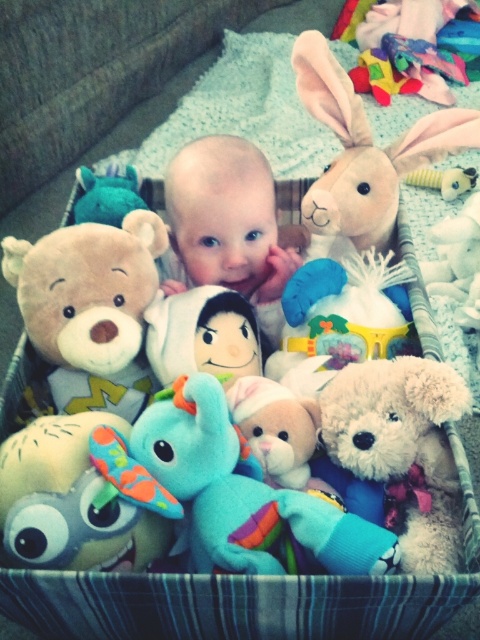
Does soft plush toys at center have a smaller size compared to teal plush elephant at center?

No, soft plush toys at center is not smaller than teal plush elephant at center.

Does point (144, 180) come farther from viewer compared to point (250, 472)?

Yes, point (144, 180) is farther from viewer.

Locate an element on the screen. soft plush toys at center is located at coordinates (229, 605).

Between teal plush elephant at center and soft plush elephant at center, which one appears on the right side from the viewer's perspective?

teal plush elephant at center is more to the right.

Can you confirm if teal plush elephant at center is positioned to the left of soft plush elephant at center?

No, teal plush elephant at center is not to the left of soft plush elephant at center.

Between point (204, 502) and point (141, 536), which one is positioned in front?

Positioned in front is point (141, 536).

Where is `teal plush elephant at center`? The image size is (480, 640). teal plush elephant at center is located at coordinates (243, 492).

Does smooth skin baby at center appear over multicolored fabric toy at upper right?

Actually, smooth skin baby at center is below multicolored fabric toy at upper right.

Is point (177, 188) behind point (400, 22)?

No, it is in front of (400, 22).

What do you see at coordinates (228, 224) in the screenshot? Image resolution: width=480 pixels, height=640 pixels. I see `smooth skin baby at center` at bounding box center [228, 224].

Locate an element on the screen. The width and height of the screenshot is (480, 640). smooth skin baby at center is located at coordinates [x=228, y=224].